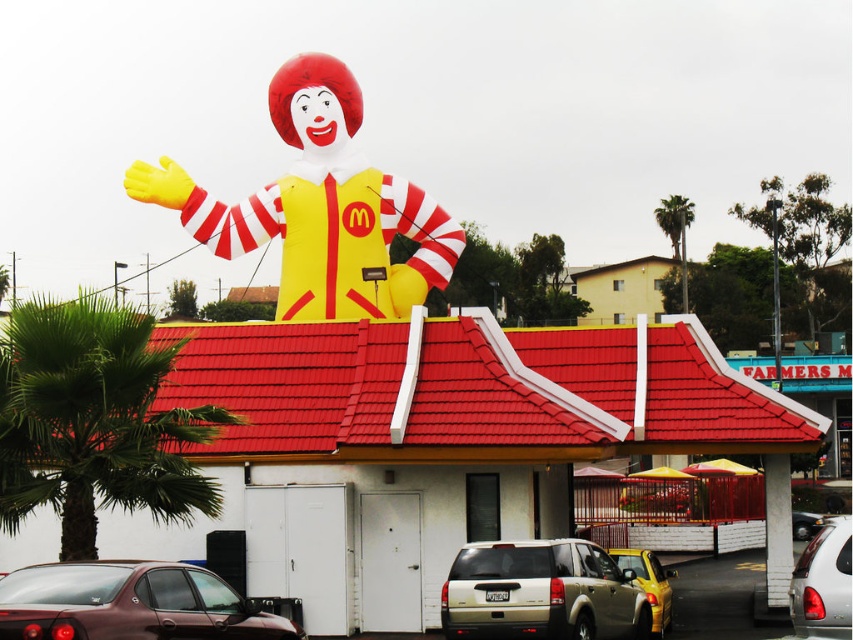
Question: Which object appears farthest from the camera in this image?

Choices:
 (A) red tile roof at center
 (B) gold metallic suv at lower center
 (C) matte yellow plastic ronald mcdonald at center

Answer: (C)

Question: Is red tile roof at center to the right of green leafy palm tree at upper right from the viewer's perspective?

Choices:
 (A) yes
 (B) no

Answer: (B)

Question: Which object is farther from the camera taking this photo?

Choices:
 (A) red tile roof at center
 (B) matte yellow plastic ronald mcdonald at center
 (C) gold metallic suv at lower center

Answer: (B)

Question: Does matte yellow plastic ronald mcdonald at center have a smaller size compared to gold metallic suv at lower center?

Choices:
 (A) yes
 (B) no

Answer: (B)

Question: Which object is positioned farthest from the green leafy palm tree at upper right?

Choices:
 (A) metallic silver car at center
 (B) metallic maroon sedan at lower left

Answer: (B)

Question: Does silver metallic car at lower right have a lesser width compared to green leafy palm tree at upper right?

Choices:
 (A) no
 (B) yes

Answer: (B)